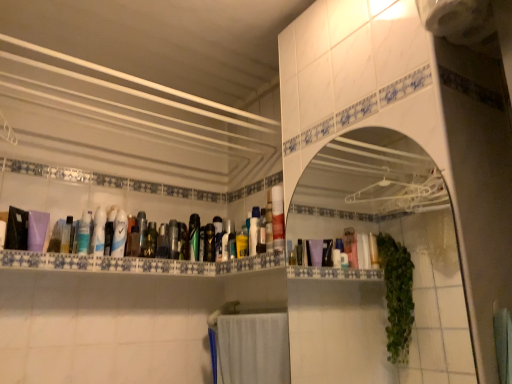
What do you see at coordinates (173, 239) in the screenshot? The height and width of the screenshot is (384, 512). I see `matte black bottle at center, acting as the 5th mouthwash starting from the right` at bounding box center [173, 239].

Locate an element on the screen. The height and width of the screenshot is (384, 512). yellow matte bottle at center, which is counted as the second mouthwash, starting from the right is located at coordinates (242, 243).

The width and height of the screenshot is (512, 384). I want to click on matte plastic mouthwash at center, the 3th mouthwash from the right, so click(218, 237).

How much space does white glossy mouthwash at upper left, arranged as the eighth mouthwash when viewed from the right, occupy horizontally?

It is 1.69 inches.

At what (x,y) coordinates should I click in order to perform the action: click on white fabric bath towel at lower center. Please return your answer as a coordinate pair (x, y). Looking at the image, I should click on (253, 349).

Which object is thinner, clear plastic bottles at center or white glossy mirror at center?

Thinner between the two is white glossy mirror at center.

From the image's perspective, is clear plastic bottles at center positioned above or below white glossy mirror at center?

From the image's perspective, clear plastic bottles at center appears below white glossy mirror at center.

Considering the positions of objects clear plastic bottles at center and white glossy mirror at center in the image provided, who is behind, clear plastic bottles at center or white glossy mirror at center?

clear plastic bottles at center is further from the camera.

Is clear plastic bottles at center at the left side of white glossy mirror at center?

Correct, you'll find clear plastic bottles at center to the left of white glossy mirror at center.

Would you say matte plastic mouthwash at center, the 3th mouthwash from the right, contains green matte bottle at center, placed as the third toiletry when sorted from left to right?

Definitely not — green matte bottle at center, placed as the third toiletry when sorted from left to right, is not inside matte plastic mouthwash at center, the 3th mouthwash from the right.

This screenshot has height=384, width=512. What are the coordinates of `the 4th mouthwash to the right of the green matte bottle at center, the 3th toiletry from the right, counting from the anchor's position` in the screenshot? It's located at (218, 237).

Is matte plastic mouthwash at center, which appears as the 8th mouthwash when viewed from the left, facing away from green matte bottle at center, placed as the third toiletry when sorted from left to right?

matte plastic mouthwash at center, which appears as the 8th mouthwash when viewed from the left, is not turned away from green matte bottle at center, placed as the third toiletry when sorted from left to right.

Would you say matte plastic mouthwash at center, which appears as the 8th mouthwash when viewed from the left, is a long distance from green matte bottle at center, placed as the third toiletry when sorted from left to right?

No, matte plastic mouthwash at center, which appears as the 8th mouthwash when viewed from the left, is in close proximity to green matte bottle at center, placed as the third toiletry when sorted from left to right.

Is matte black bottle at center, the fourth toiletry in the left-to-right sequence, far from clear plastic bottles at center?

That's not correct — matte black bottle at center, the fourth toiletry in the left-to-right sequence, is a little close to clear plastic bottles at center.

Is point (180, 227) closer to camera compared to point (92, 266)?

No, it is not.

Considering the sizes of objects matte black bottle at center, which is the second toiletry in right-to-left order, and clear plastic bottles at center in the image provided, who is shorter, matte black bottle at center, which is the second toiletry in right-to-left order, or clear plastic bottles at center?

With less height is clear plastic bottles at center.

Which object is positioned more to the left, green matte bottle at center, placed as the third toiletry when sorted from left to right, or white glossy mirror at center?

From the viewer's perspective, green matte bottle at center, placed as the third toiletry when sorted from left to right, appears more on the left side.

Which is closer, (143,255) or (312,221)?

Point (143,255).

From a real-world perspective, which is physically above, green matte bottle at center, placed as the third toiletry when sorted from left to right, or white glossy mirror at center?

From a 3D spatial view, green matte bottle at center, placed as the third toiletry when sorted from left to right, is above.

Which object is closer to the camera, green matte bottle at center, placed as the third toiletry when sorted from left to right, or white glossy mirror at center?

white glossy mirror at center is more forward.

Which of these two, white fabric bath towel at lower center or green matte bottle at center, the 3th toiletry from the right, is thinner?

green matte bottle at center, the 3th toiletry from the right.

From their relative heights in the image, would you say white fabric bath towel at lower center is taller or shorter than green matte bottle at center, the 3th toiletry from the right?

Clearly, white fabric bath towel at lower center is taller compared to green matte bottle at center, the 3th toiletry from the right.

Does white fabric bath towel at lower center turn towards green matte bottle at center, the 3th toiletry from the right?

No.

Is point (99, 234) farther from camera compared to point (148, 251)?

No, it is in front of (148, 251).

In the scene shown: From a real-world perspective, who is located higher, white glossy mouthwash at upper left, arranged as the eighth mouthwash when viewed from the right, or green matte bottle at center, placed as the third toiletry when sorted from left to right?

white glossy mouthwash at upper left, arranged as the eighth mouthwash when viewed from the right.

From the image's perspective, is white glossy mouthwash at upper left, the 3th mouthwash in the left-to-right sequence, on top of green matte bottle at center, placed as the third toiletry when sorted from left to right?

Yes, from the image's perspective, white glossy mouthwash at upper left, the 3th mouthwash in the left-to-right sequence, is on top of green matte bottle at center, placed as the third toiletry when sorted from left to right.

Considering the positions of objects white glossy mouthwash at upper left, the 3th mouthwash in the left-to-right sequence, and green matte bottle at center, placed as the third toiletry when sorted from left to right, in the image provided, who is more to the right, white glossy mouthwash at upper left, the 3th mouthwash in the left-to-right sequence, or green matte bottle at center, placed as the third toiletry when sorted from left to right,?

green matte bottle at center, placed as the third toiletry when sorted from left to right, is more to the right.

Which of these two, matte black lotion at center, which is the first toiletry from left to right, or white glossy mouthwash at upper left, the 3th mouthwash in the left-to-right sequence, is wider?

Wider between the two is matte black lotion at center, which is the first toiletry from left to right.

Do you think matte black lotion at center, which is the fifth toiletry in right-to-left order, is within white glossy mouthwash at upper left, the 3th mouthwash in the left-to-right sequence, or outside of it?

matte black lotion at center, which is the fifth toiletry in right-to-left order, is not inside white glossy mouthwash at upper left, the 3th mouthwash in the left-to-right sequence, it's outside.

Does matte black lotion at center, which is the fifth toiletry in right-to-left order, touch white glossy mouthwash at upper left, the 3th mouthwash in the left-to-right sequence?

Yes, matte black lotion at center, which is the fifth toiletry in right-to-left order, is right next to white glossy mouthwash at upper left, the 3th mouthwash in the left-to-right sequence, and making contact.

In the scene shown: From a real-world perspective, is matte black lotion at center, which is the first toiletry from left to right, positioned above or below white glossy mouthwash at upper left, arranged as the eighth mouthwash when viewed from the right?

From a real-world perspective, matte black lotion at center, which is the first toiletry from left to right, is physically above white glossy mouthwash at upper left, arranged as the eighth mouthwash when viewed from the right.

This screenshot has height=384, width=512. I want to click on ledge on the left of the white glossy mirror at center, so coord(136,263).

This screenshot has width=512, height=384. Find the location of `the 1st mouthwash positioned below the green matte bottle at center, placed as the third toiletry when sorted from left to right (from the image's perspective)`. the 1st mouthwash positioned below the green matte bottle at center, placed as the third toiletry when sorted from left to right (from the image's perspective) is located at coordinates (218, 237).

From the image, which object appears to be nearer to metallic gold clock at center, the fifth toiletry from the left, green matte bottle at center, placed as the third toiletry when sorted from left to right, or matte black lotion at center, which is the first toiletry from left to right?

The object closer to metallic gold clock at center, the fifth toiletry from the left, is green matte bottle at center, placed as the third toiletry when sorted from left to right.

Estimate the real-world distances between objects in this image. Which object is closer to translucent plastic mouthwash at upper left, which appears as the second mouthwash when viewed from the left, clear plastic bottles at center or translucent plastic mouthwash at center, positioned as the 6th mouthwash in right-to-left order?

clear plastic bottles at center lies closer to translucent plastic mouthwash at upper left, which appears as the second mouthwash when viewed from the left, than the other object.

Estimate the real-world distances between objects in this image. Which object is closer to white glossy mouthwash at upper left, arranged as the eighth mouthwash when viewed from the right, matte plastic mouthwash at center, which appears as the 8th mouthwash when viewed from the left, or metallic gold clock at center, the 1th toiletry positioned from the right?

metallic gold clock at center, the 1th toiletry positioned from the right.

When comparing their distances from metallic gold clock at center, the fifth toiletry from the left, does green matte bottle at center, the 3th toiletry from the right, or yellow matte bottle at center, which is counted as the second mouthwash, starting from the right, seem further?

green matte bottle at center, the 3th toiletry from the right.

Which object lies nearer to the anchor point green matte bottle at center, placed as the third toiletry when sorted from left to right, white glossy mouthwash at center, marked as the seventh mouthwash in a right-to-left arrangement, or clear plastic bottles at center?

white glossy mouthwash at center, marked as the seventh mouthwash in a right-to-left arrangement, is positioned closer to the anchor green matte bottle at center, placed as the third toiletry when sorted from left to right.

Looking at the image, which one is located further to white glossy mirror at center, green matte bottle at center, the 3th toiletry from the right, or shiny metallic can at center, acting as the second toiletry starting from the left?

shiny metallic can at center, acting as the second toiletry starting from the left.

Estimate the real-world distances between objects in this image. Which object is further from green glossy bottle at center, the 7th mouthwash when ordered from left to right, translucent plastic mouthwash at upper left, which appears as the second mouthwash when viewed from the left, or white fabric bath towel at lower center?

white fabric bath towel at lower center is positioned further to the anchor green glossy bottle at center, the 7th mouthwash when ordered from left to right.

From the picture: When comparing their distances from shiny metallic can at center, positioned as the fourth toiletry in right-to-left order, does yellow matte bottle at center, marked as the 9th mouthwash in a left-to-right arrangement, or metallic gold clock at center, the 1th toiletry positioned from the right, seem further?

yellow matte bottle at center, marked as the 9th mouthwash in a left-to-right arrangement, is positioned further to the anchor shiny metallic can at center, positioned as the fourth toiletry in right-to-left order.

Where is `toiletry situated between matte black bottle at center, acting as the 5th mouthwash starting from the right, and green glossy bottle at center, the 7th mouthwash when ordered from left to right, from left to right`? The height and width of the screenshot is (384, 512). toiletry situated between matte black bottle at center, acting as the 5th mouthwash starting from the right, and green glossy bottle at center, the 7th mouthwash when ordered from left to right, from left to right is located at coordinates (183, 241).

I want to click on ledge situated between matte black lotion at center, which is the fifth toiletry in right-to-left order, and white fabric bath towel at lower center from left to right, so click(x=136, y=263).

This screenshot has height=384, width=512. Identify the location of ledge between white glossy mouthwash at upper left, the 3th mouthwash in the left-to-right sequence, and white glossy mirror at center. (136, 263).

What are the coordinates of `ledge between translucent plastic mouthwash at upper left, placed as the ninth mouthwash when sorted from right to left, and matte plastic mouthwash at center, which appears as the 8th mouthwash when viewed from the left, from left to right` in the screenshot? It's located at (136, 263).